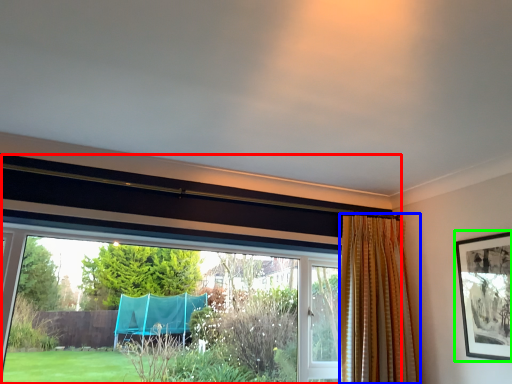
Question: Which is farther away from window (highlighted by a red box)? curtain (highlighted by a blue box) or picture frame (highlighted by a green box)?

Choices:
 (A) curtain
 (B) picture frame

Answer: (B)